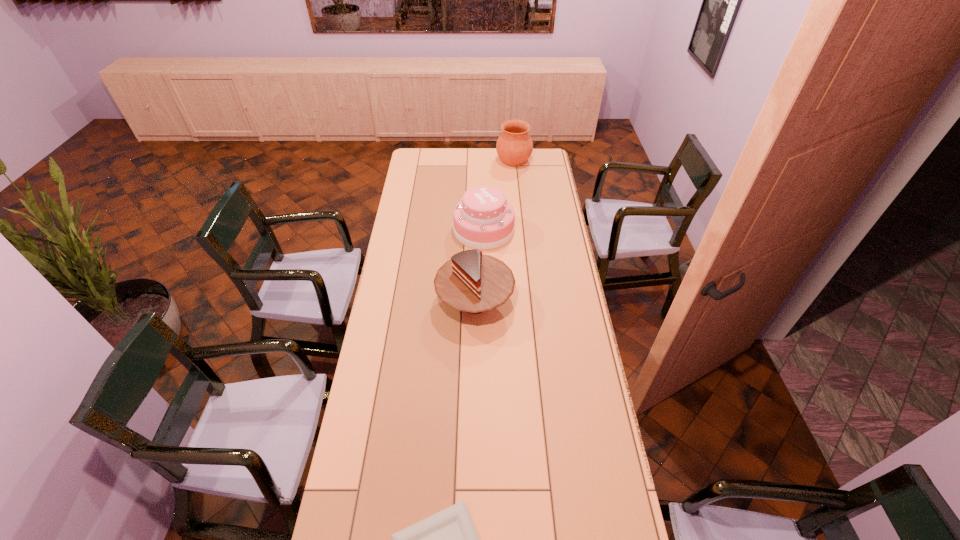
Locate an element on the screen. vacant space at the left edge of the desktop is located at coordinates (406, 183).

At what (x,y) coordinates should I click in order to perform the action: click on vacant space at the right edge of the desktop. Please return your answer as a coordinate pair (x, y). Looking at the image, I should click on (540, 174).

Identify the location of object identified as the second closest to the farthest cake. (514, 146).

Identify the location of object that can be found as the third closest to the nearest object. The image size is (960, 540). (514, 146).

Locate an element on the screen. Image resolution: width=960 pixels, height=540 pixels. the closest cake relative to the farthest cake is located at coordinates (471, 282).

Locate an element on the screen. cake that is the closest to the third farthest object is located at coordinates (483, 219).